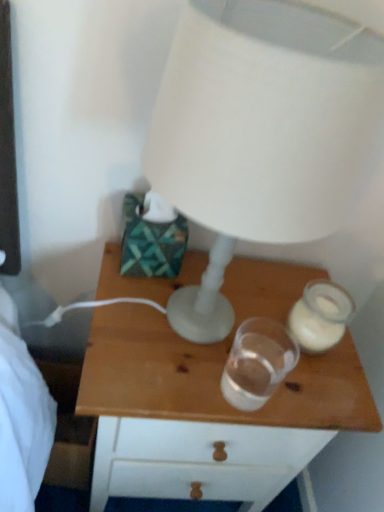
Question: Considering the positions of translucent glass candle holder at right, the first candle holder in the right-to-left sequence, and transparent glass at center, positioned as the second candle holder in right-to-left order, in the image, is translucent glass candle holder at right, the first candle holder in the right-to-left sequence, wider or thinner than transparent glass at center, positioned as the second candle holder in right-to-left order,?

Choices:
 (A) thin
 (B) wide

Answer: (B)

Question: From a real-world perspective, is translucent glass candle holder at right, the second candle holder viewed from the left, positioned above or below transparent glass at center, positioned as the second candle holder in right-to-left order?

Choices:
 (A) above
 (B) below

Answer: (B)

Question: Estimate the real-world distances between objects in this image. Which object is farther from the wooden nightstand at center?

Choices:
 (A) translucent glass candle holder at right, the first candle holder in the right-to-left sequence
 (B) transparent glass at center, the first candle holder positioned from the left
 (C) white matte lamp at upper center

Answer: (C)

Question: Which object is the farthest from the white matte lamp at upper center?

Choices:
 (A) wooden nightstand at center
 (B) transparent glass at center, positioned as the second candle holder in right-to-left order
 (C) translucent glass candle holder at right, the first candle holder in the right-to-left sequence

Answer: (C)